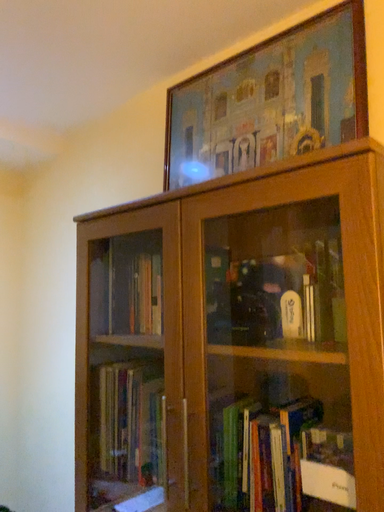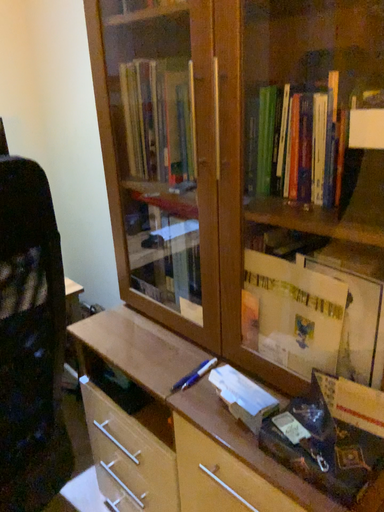
Question: Which way did the camera rotate in the video?

Choices:
 (A) rotated downward
 (B) rotated upward

Answer: (A)